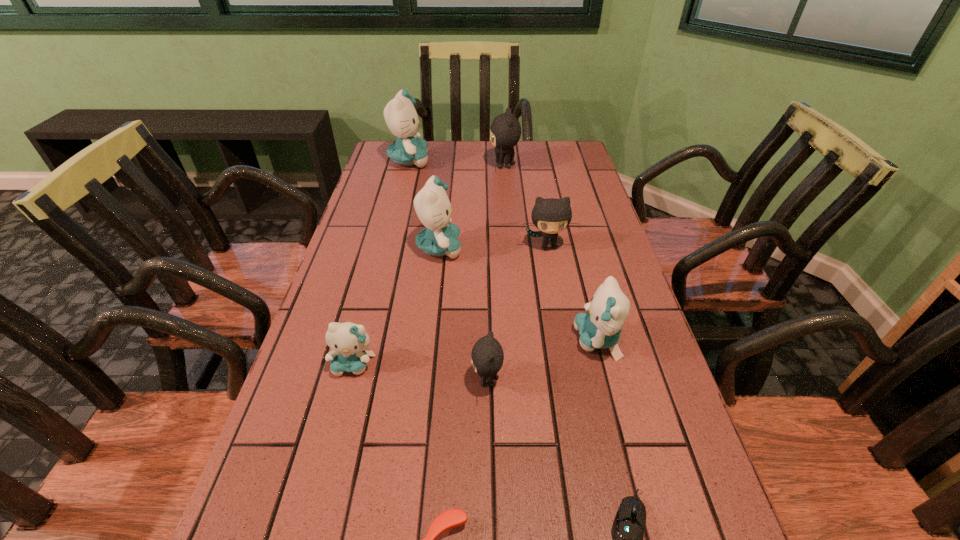
Identify the location of free space located 0.300m on the face of the third smallest blue kitten. (574, 248).

Where is `free region located 0.060m on the front-facing side of the biggest gray kitten`? The image size is (960, 540). free region located 0.060m on the front-facing side of the biggest gray kitten is located at coordinates (471, 165).

What are the coordinates of `free point located on the front-facing side of the biggest gray kitten` in the screenshot? It's located at (425, 165).

Where is `free space located on the front-facing side of the biggest gray kitten`? The image size is (960, 540). free space located on the front-facing side of the biggest gray kitten is located at coordinates (405, 165).

Where is `vacant area located 0.110m on the face of the rightmost blue kitten`? The height and width of the screenshot is (540, 960). vacant area located 0.110m on the face of the rightmost blue kitten is located at coordinates (523, 340).

The height and width of the screenshot is (540, 960). I want to click on free spot located 0.150m on the face of the rightmost blue kitten, so click(504, 340).

This screenshot has width=960, height=540. I want to click on vacant region located on the face of the rightmost blue kitten, so pyautogui.click(x=533, y=340).

The image size is (960, 540). What are the coordinates of `blank space located on the front-facing side of the second biggest gray kitten` in the screenshot? It's located at (562, 320).

Image resolution: width=960 pixels, height=540 pixels. What are the coordinates of `blank space located 0.050m on the face of the smallest blue kitten` in the screenshot? It's located at click(x=344, y=401).

You are a GUI agent. You are given a task and a screenshot of the screen. Output one action in this format:
    pyautogui.click(x=<x>, y=<y>)
    Task: Click on the vacant space positioned 0.230m on the front-facing side of the smallest gray kitten
    The width and height of the screenshot is (960, 540).
    Given the screenshot: What is the action you would take?
    pyautogui.click(x=354, y=380)